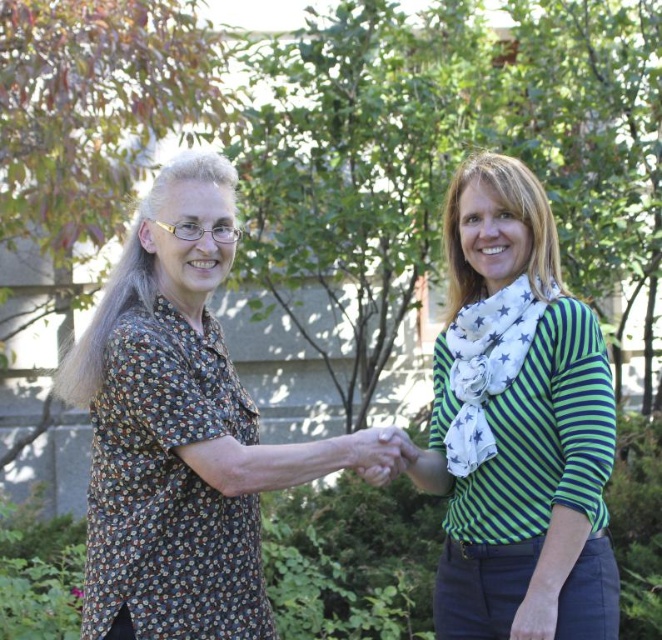
Is brown floral shirt at left thinner than smooth skin hand at center?

No, brown floral shirt at left is not thinner than smooth skin hand at center.

Is brown floral shirt at left positioned behind smooth skin hand at center?

No, brown floral shirt at left is closer to the viewer.

Who is more forward, (122, 358) or (393, 467)?

Point (122, 358)

This screenshot has width=662, height=640. Identify the location of brown floral shirt at left. (177, 429).

Who is taller, green striped shirt at center or smooth skin hand at center?

green striped shirt at center

Is green striped shirt at center positioned in front of smooth skin hand at center?

Yes, green striped shirt at center is closer to the viewer.

Who is more forward, (504, 193) or (395, 433)?

Point (395, 433)

This screenshot has height=640, width=662. What are the coordinates of `green striped shirt at center` in the screenshot? It's located at (516, 426).

Who is taller, brown floral shirt at left or green striped shirt at center?

With more height is green striped shirt at center.

What do you see at coordinates (177, 429) in the screenshot?
I see `brown floral shirt at left` at bounding box center [177, 429].

The width and height of the screenshot is (662, 640). I want to click on brown floral shirt at left, so click(x=177, y=429).